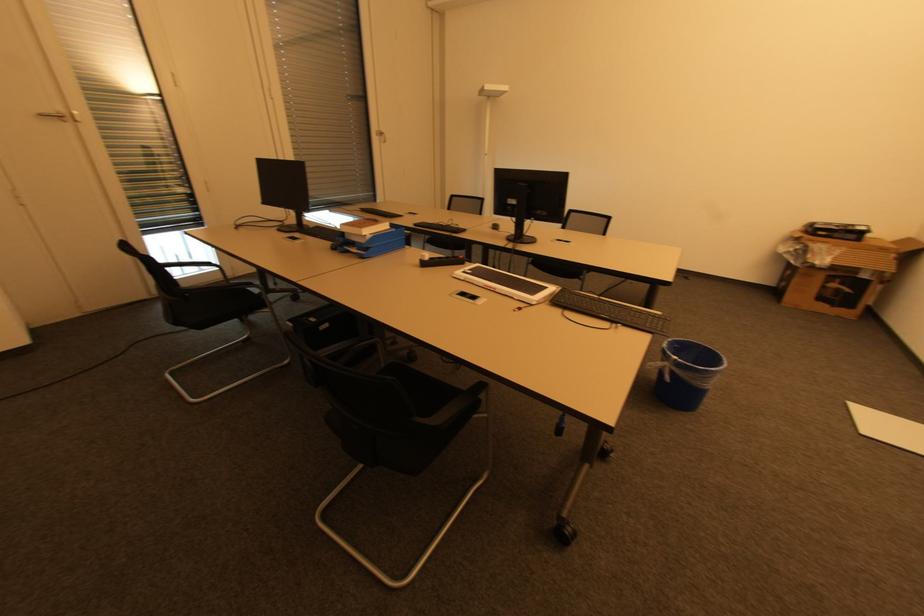
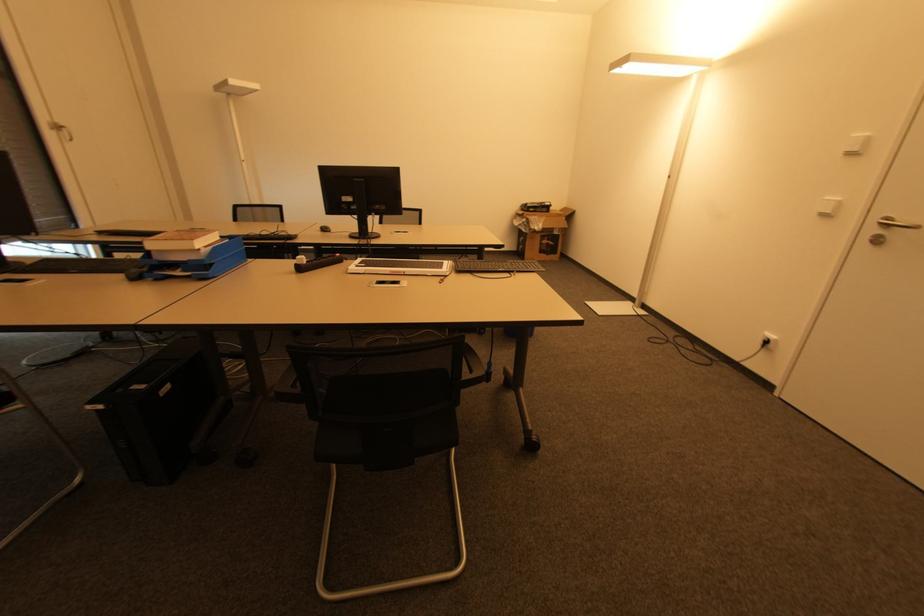
Question: The camera is either moving clockwise (left) or counter-clockwise (right) around the object. The first image is from the beginning of the video and the second image is from the end. Is the camera moving left or right when shooting the video?

Choices:
 (A) Left
 (B) Right

Answer: (A)